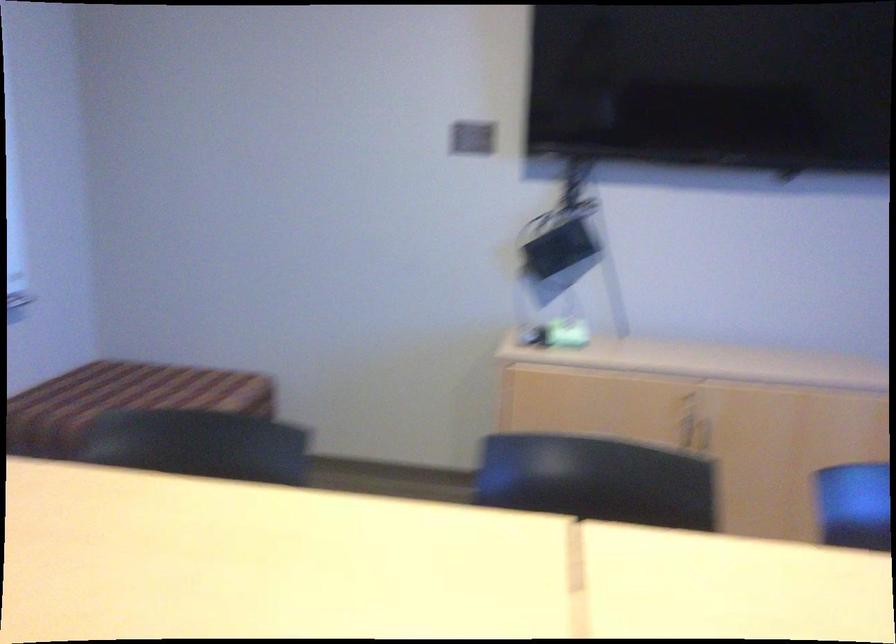
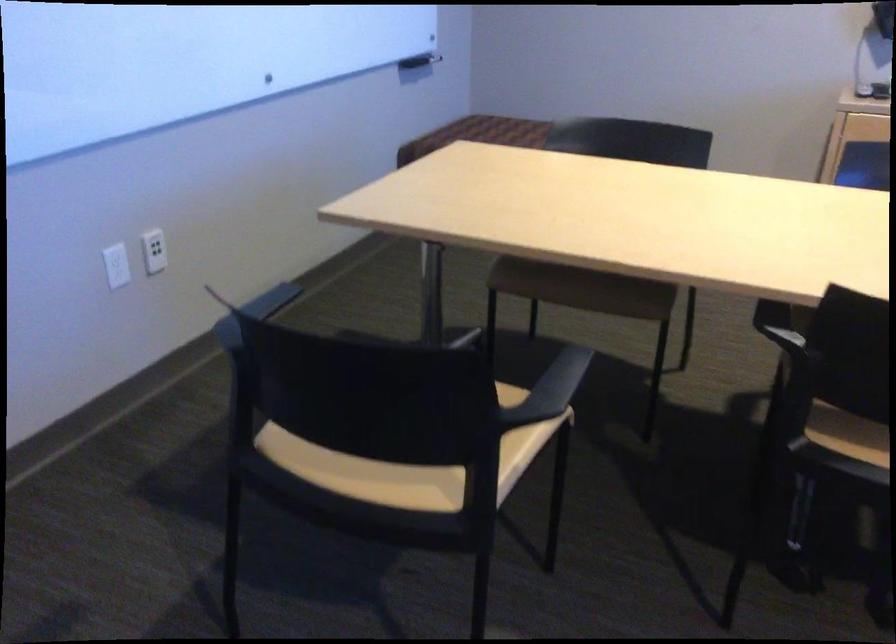
Question: The images are taken continuously from a first-person perspective. In which direction is your viewpoint rotating?

Choices:
 (A) Left
 (B) Right
 (C) Up
 (D) Down

Answer: (A)